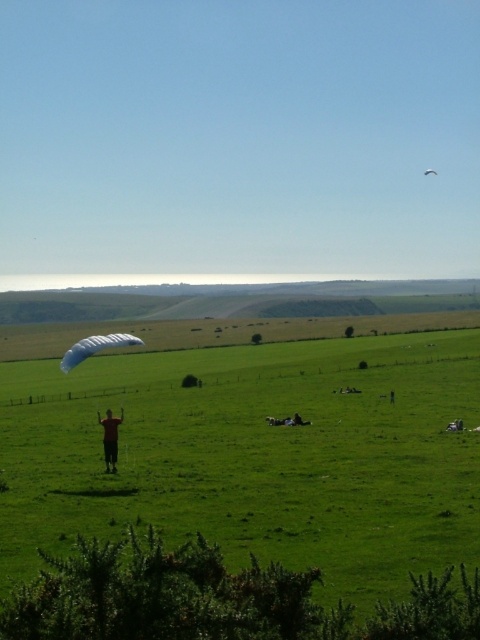
Question: Which object appears closest to the camera in this image?

Choices:
 (A) white fabric parachute at upper center
 (B) dark brown leather jacket at center

Answer: (B)

Question: Can you confirm if green grassy field at center is thinner than dark brown leather jacket at center?

Choices:
 (A) no
 (B) yes

Answer: (A)

Question: Which object is the closest to the white matte parachute at lower left?

Choices:
 (A) dark brown leather jacket at center
 (B) green grassy field at center

Answer: (A)

Question: Observing the image, what is the correct spatial positioning of dark brown leather jacket at center in reference to white fabric parachute at upper center?

Choices:
 (A) below
 (B) above

Answer: (A)

Question: Does dark brown leather jacket at center appear on the right side of white fabric parachute at upper center?

Choices:
 (A) no
 (B) yes

Answer: (A)

Question: Which object is closer to the camera taking this photo?

Choices:
 (A) dark brown leather jacket at center
 (B) white fabric parachute at upper center
 (C) white matte parachute at lower left

Answer: (C)